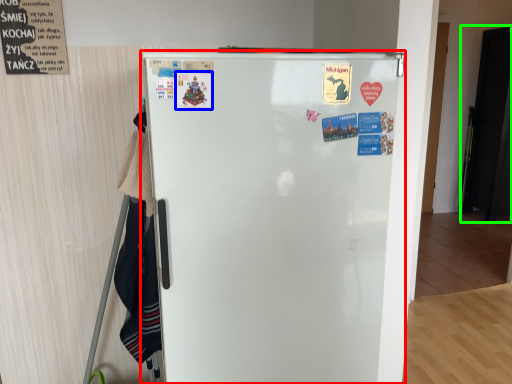
Question: Which object is positioned farthest from refrigerator (highlighted by a red box)? Select from poster (highlighted by a blue box) and door (highlighted by a green box).

Choices:
 (A) poster
 (B) door

Answer: (B)